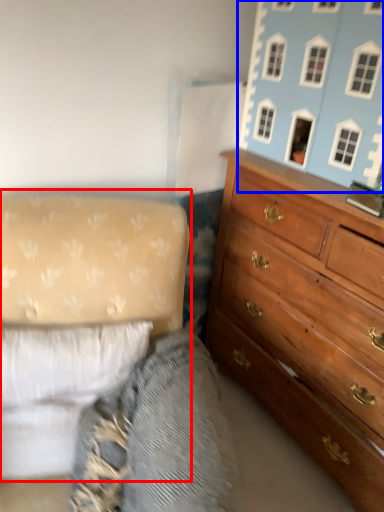
Question: Among these objects, which one is nearest to the camera, studio couch (highlighted by a red box) or toy (highlighted by a blue box)?

Choices:
 (A) studio couch
 (B) toy

Answer: (A)